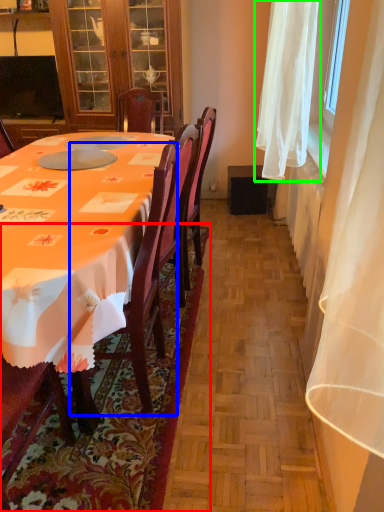
Question: Which is farther away from mat (highlighted by a red box)? chair (highlighted by a blue box) or curtain (highlighted by a green box)?

Choices:
 (A) chair
 (B) curtain

Answer: (B)